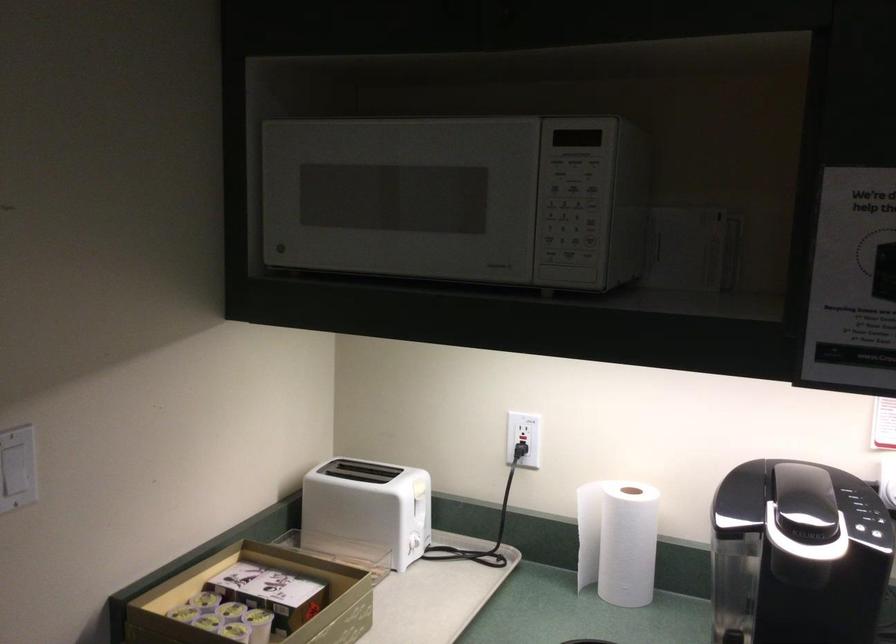
I want to click on paper towel roll, so click(x=617, y=540).